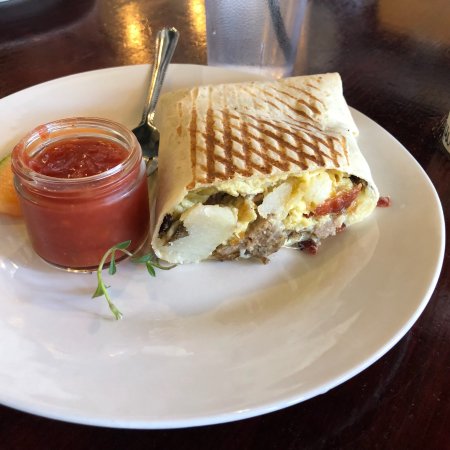
The width and height of the screenshot is (450, 450). What are the coordinates of `cup of water` in the screenshot? It's located at (251, 34).